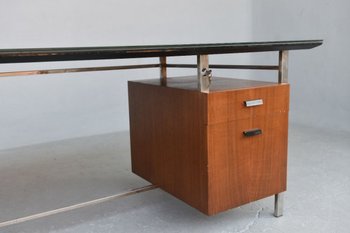
Where is `drawer`? This screenshot has height=233, width=350. drawer is located at coordinates [226, 104].